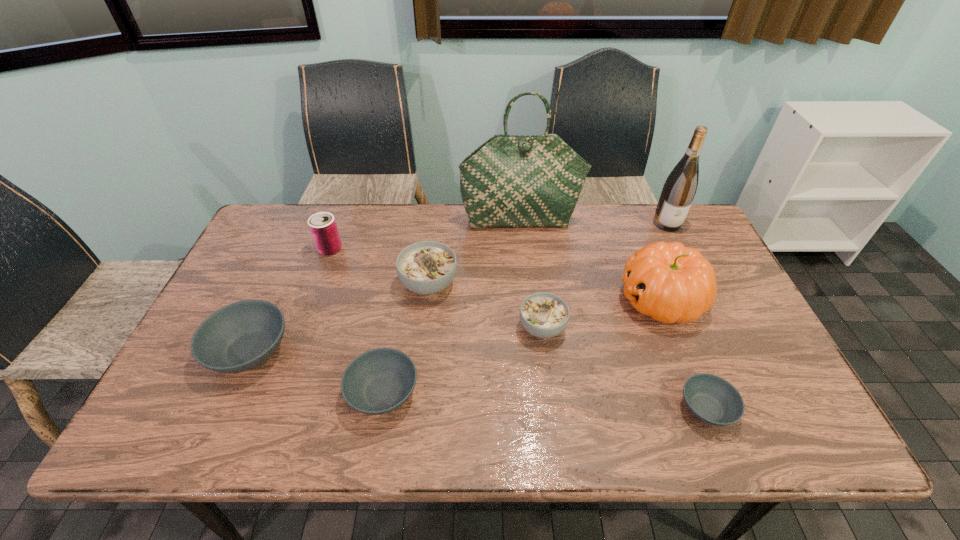
Where is `unoccupied position between the seventh nearest object and the eighth shortest object`? unoccupied position between the seventh nearest object and the eighth shortest object is located at coordinates click(498, 236).

Find the location of a particular element. The height and width of the screenshot is (540, 960). vacant space in between the shortest object and the third tallest object is located at coordinates (684, 354).

Locate an element on the screen. blank region between the pink can and the smallest gray soup bowl is located at coordinates (518, 329).

Identify the location of the seventh closest object to the fourth soup bowl from left to right. (323, 228).

Find the location of a particular element. The image size is (960, 540). the third closest object to the orange pumpkin is located at coordinates (678, 192).

Identify the location of soup bowl that is the closest to the right white soup bowl. Image resolution: width=960 pixels, height=540 pixels. (428, 267).

Select which soup bowl appears as the second closest to the smaller white soup bowl. Please provide its 2D coordinates. Your answer should be formatted as a tuple, i.e. [(x, y)], where the tuple contains the x and y coordinates of a point satisfying the conditions above.

[(712, 399)]

Identify which gray soup bowl is located as the second nearest to the second shortest soup bowl. Please provide its 2D coordinates. Your answer should be formatted as a tuple, i.e. [(x, y)], where the tuple contains the x and y coordinates of a point satisfying the conditions above.

[(712, 399)]

Where is `the second closest gray soup bowl to the second biggest gray soup bowl`? the second closest gray soup bowl to the second biggest gray soup bowl is located at coordinates (712, 399).

What are the coordinates of `vacant area in the image that satisfies the following two spatial constraints: 1. on the carved face of the pumpkin; 2. on the back side of the shortest object` in the screenshot? It's located at (704, 408).